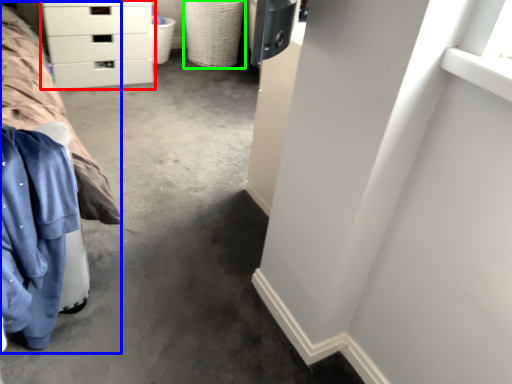
Question: Which object is positioned farthest from chest of drawers (highlighted by a red box)? Select from bed (highlighted by a blue box) and basket (highlighted by a green box).

Choices:
 (A) bed
 (B) basket

Answer: (A)